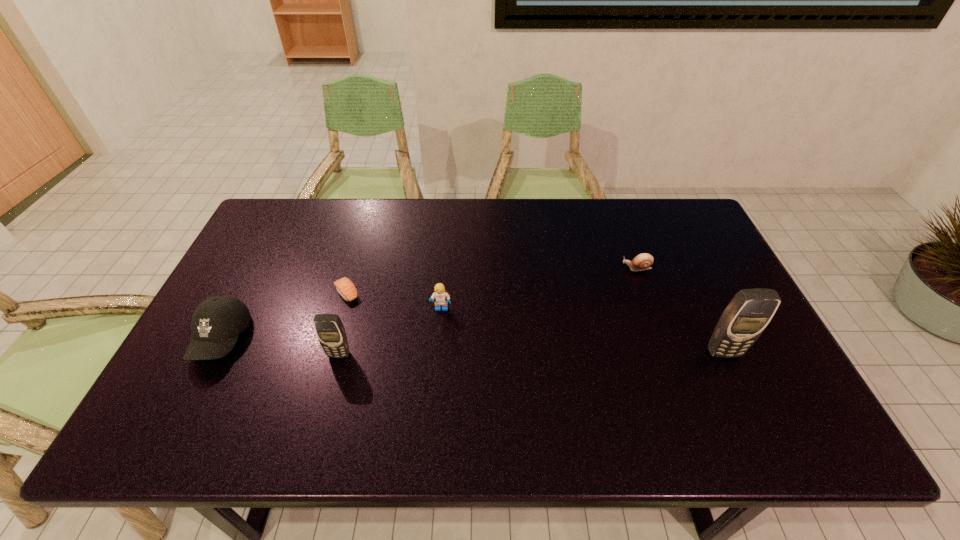
This screenshot has height=540, width=960. Find the location of `the second tallest object`. the second tallest object is located at coordinates (329, 328).

I want to click on the left cellular telephone, so click(329, 328).

Where is `the taller cellular telephone`? the taller cellular telephone is located at coordinates (750, 311).

Where is `the right cellular telephone`? The height and width of the screenshot is (540, 960). the right cellular telephone is located at coordinates (750, 311).

Locate an element on the screen. This screenshot has height=540, width=960. the farthest object is located at coordinates tap(643, 261).

What are the coordinates of `the second shortest object` in the screenshot? It's located at (643, 261).

Find the location of a particular element. the fourth object from left to right is located at coordinates (439, 294).

This screenshot has height=540, width=960. Find the location of `baseball cap`. baseball cap is located at coordinates (217, 322).

In order to click on the shortest object in this screenshot , I will do `click(344, 286)`.

The height and width of the screenshot is (540, 960). I want to click on vacant region located 0.100m on the front face of the fifth shortest object, so click(328, 395).